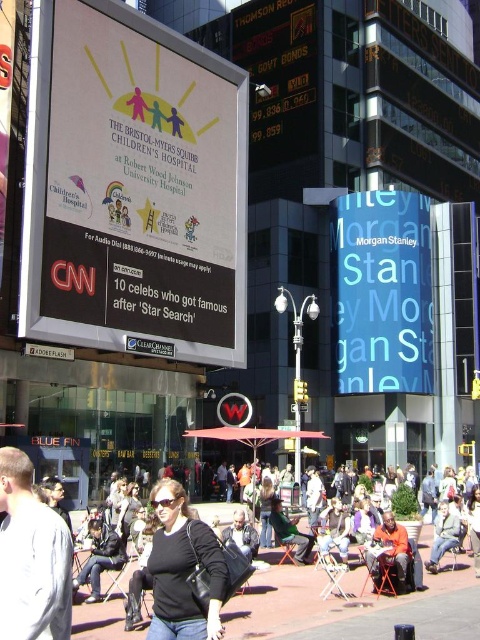
Question: Which of the following is the closest to the observer?

Choices:
 (A) dark blue jeans at lower left
 (B) black leather jacket at center
 (C) green fabric chair at center
 (D) denim jacket at lower right

Answer: (B)

Question: Can you confirm if black leather jacket at center is positioned to the left of dark gray jacket at center?

Choices:
 (A) no
 (B) yes

Answer: (B)

Question: Does black leather jacket at lower center appear on the left side of dark blue jeans at lower left?

Choices:
 (A) yes
 (B) no

Answer: (B)

Question: Which object appears closest to the camera in this image?

Choices:
 (A) black leather jacket at center
 (B) green fabric chair at center
 (C) denim jacket at lower right

Answer: (A)

Question: Which of the following is the farthest from the observer?

Choices:
 (A) black leather jacket at lower center
 (B) dark gray jacket at lower left

Answer: (B)

Question: Can you confirm if white glossy billboard at upper left is smaller than blue glossy morgan stanley sign at upper right?

Choices:
 (A) no
 (B) yes

Answer: (A)